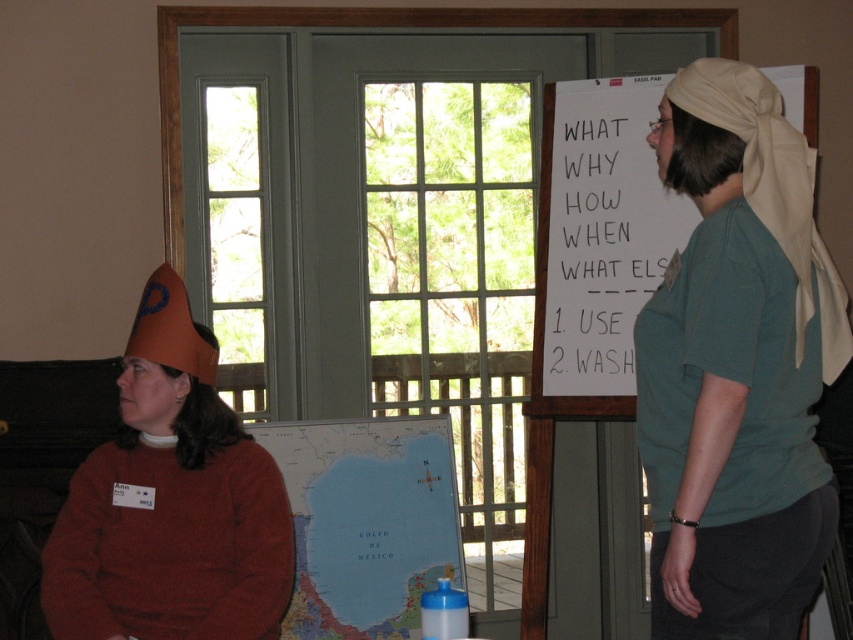
Question: Which point is farther from the camera taking this photo?

Choices:
 (A) (338, 538)
 (B) (666, 76)
 (C) (697, 141)
 (D) (131, 493)

Answer: (A)

Question: Which object is positioned closest to the orange felt cone hat at left?

Choices:
 (A) green cotton shirt at right
 (B) map paper at center

Answer: (B)

Question: Is green cotton shirt at right closer to the viewer compared to orange felt cone hat at left?

Choices:
 (A) no
 (B) yes

Answer: (B)

Question: Does green cotton shirt at right have a smaller size compared to orange felt cone hat at left?

Choices:
 (A) no
 (B) yes

Answer: (A)

Question: Does white paper at upper center have a smaller size compared to map paper at center?

Choices:
 (A) yes
 (B) no

Answer: (A)

Question: Which point is closer to the camera?

Choices:
 (A) map paper at center
 (B) green cotton shirt at right
 (C) orange felt cone hat at left

Answer: (B)